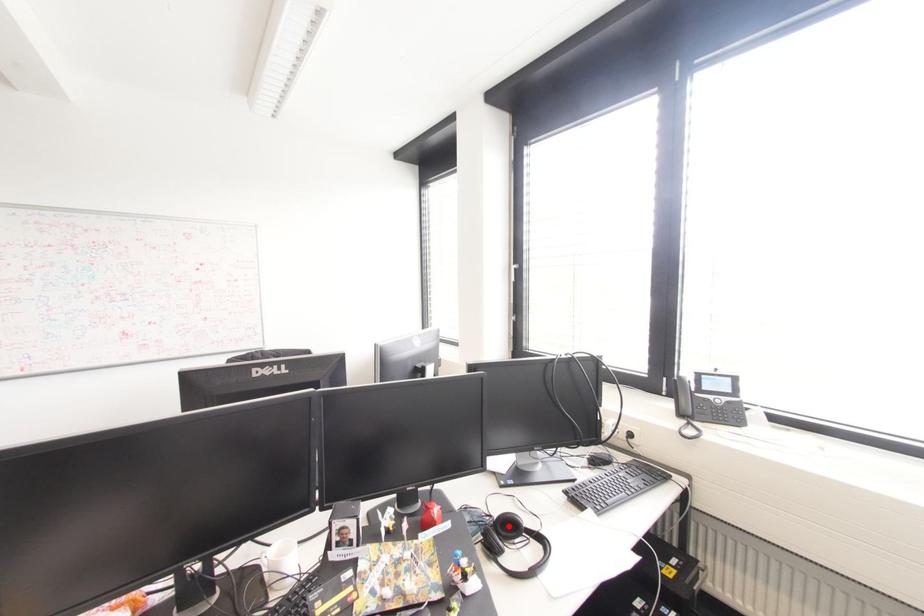
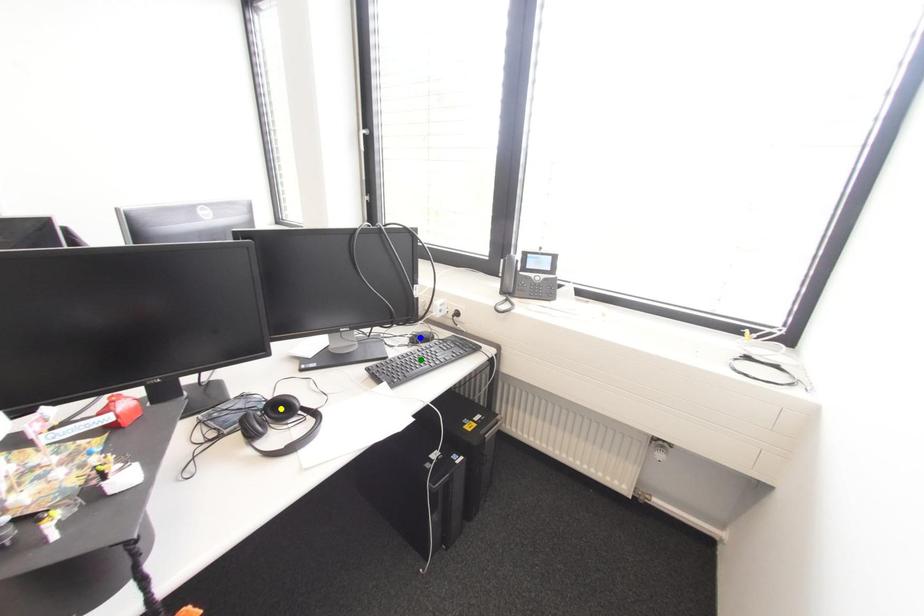
Question: I am providing you with two images of the same scene from different viewpoints. A red point is marked on the first image. You are given multiple points on the second image. In image 2, which mark is for the same physical point as the one in image 1?

Choices:
 (A) green point
 (B) yellow point
 (C) blue point

Answer: (B)